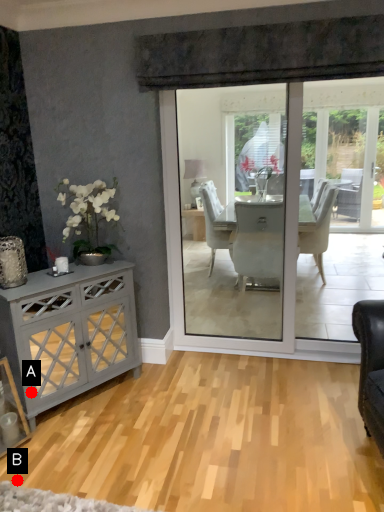
Question: Two points are circled on the image, labeled by A and B beside each circle. Which point is closer to the camera taking this photo?

Choices:
 (A) A is closer
 (B) B is closer

Answer: (B)